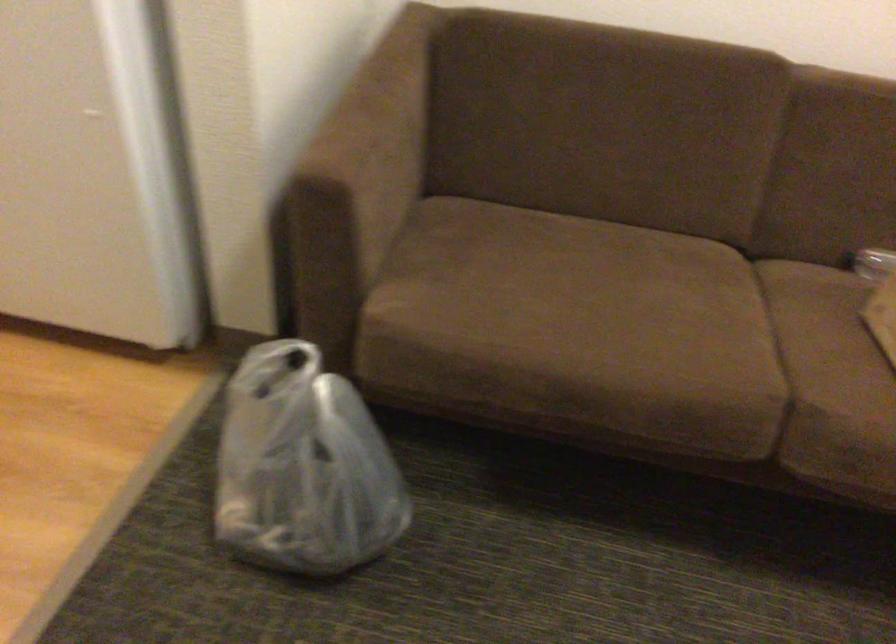
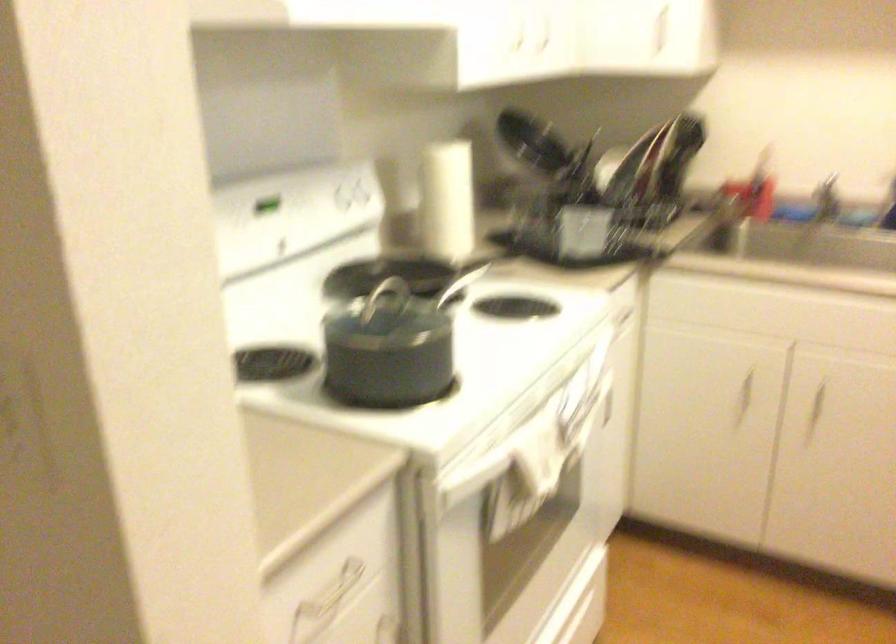
Question: Which direction would the cameraman need to move to produce the second image? Reply with the corresponding letter.

Choices:
 (A) Left
 (B) Right
 (C) Forward
 (D) Backward

Answer: (A)